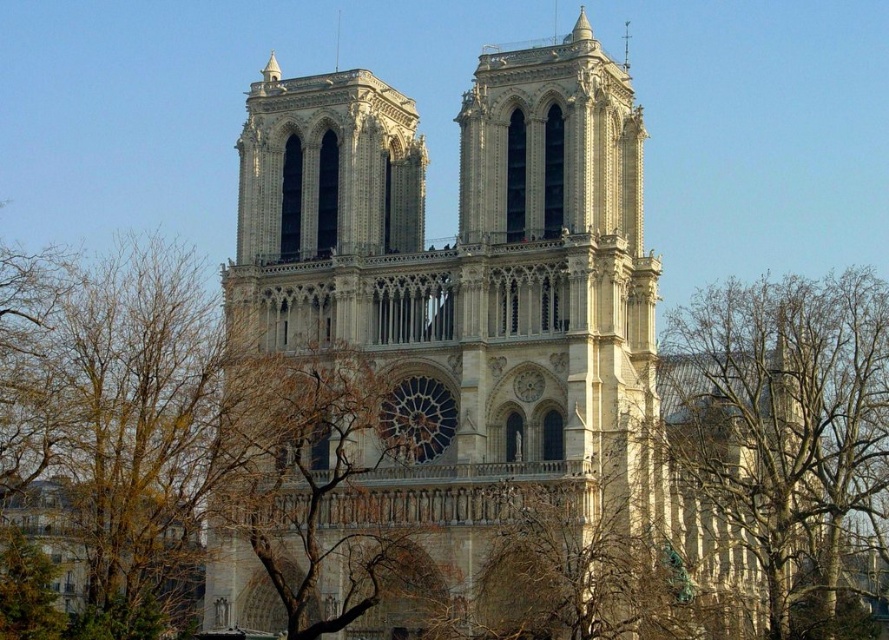
Question: Which is farther from the brown leafy tree at left?

Choices:
 (A) brown leafless branches at center
 (B) stone cathedral at center

Answer: (B)

Question: Can you confirm if stone cathedral at center is wider than brown leafless branches at center?

Choices:
 (A) no
 (B) yes

Answer: (B)

Question: Can you confirm if stone cathedral at center is positioned to the left of brown leafless branches at center?

Choices:
 (A) no
 (B) yes

Answer: (A)

Question: Among these points, which one is farthest from the camera?

Choices:
 (A) (279, 499)
 (B) (810, 330)

Answer: (B)

Question: Considering the real-world distances, which object is farthest from the brown leafy tree at left?

Choices:
 (A) brown leafless branches at center
 (B) bare branches at right

Answer: (B)

Question: Does stone cathedral at center have a larger size compared to brown leafy tree at left?

Choices:
 (A) no
 (B) yes

Answer: (B)